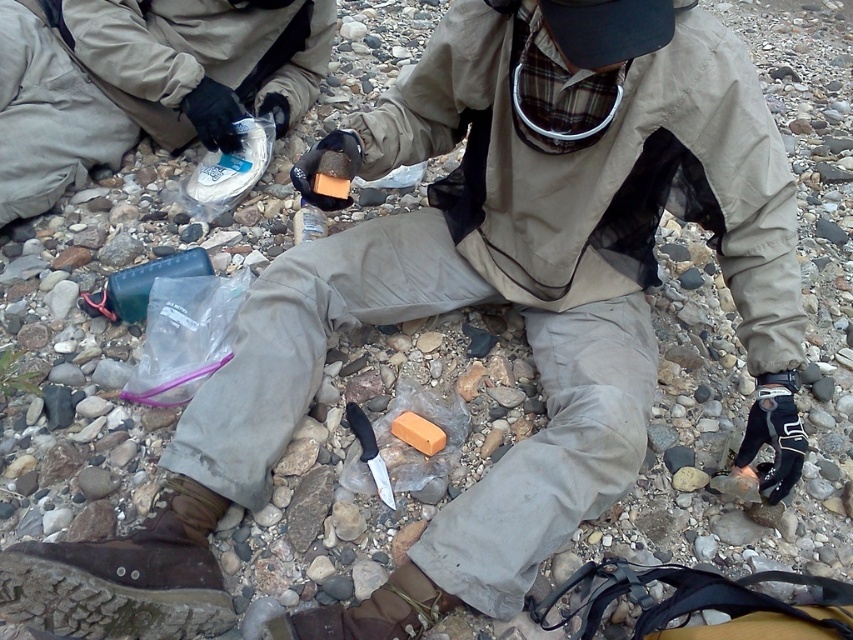
Question: Does brown suede shoe at lower center come in front of black plastic knife at center?

Choices:
 (A) yes
 (B) no

Answer: (A)

Question: Which is nearer to the green plastic bottle at center?

Choices:
 (A) brown suede shoe at lower center
 (B) black plastic knife at center

Answer: (B)

Question: Which point is farther to the camera?

Choices:
 (A) (381, 483)
 (B) (165, 269)

Answer: (B)

Question: Is matte khaki pants at center wider than black plastic knife at center?

Choices:
 (A) no
 (B) yes

Answer: (B)

Question: Can you confirm if matte khaki pants at center is positioned below black plastic knife at center?

Choices:
 (A) yes
 (B) no

Answer: (B)

Question: Among these objects, which one is farthest from the camera?

Choices:
 (A) brown leather shoe at lower left
 (B) green plastic bottle at center
 (C) matte khaki pants at center
 (D) black plastic knife at center

Answer: (C)